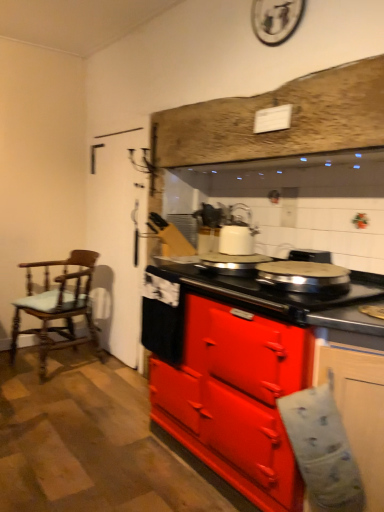
Question: Which direction should I rotate to face matte red stove at center, acting as the first cabinetry starting from the back, — up or down?

Choices:
 (A) up
 (B) down

Answer: (B)

Question: Is matte red stove at center, acting as the first cabinetry starting from the back, positioned in front of matte white cabinet at lower right, which is the first cabinetry from front to back?

Choices:
 (A) yes
 (B) no

Answer: (B)

Question: Can you confirm if matte red stove at center, acting as the first cabinetry starting from the back, is thinner than matte white cabinet at lower right, which is the first cabinetry from front to back?

Choices:
 (A) yes
 (B) no

Answer: (B)

Question: Can you confirm if matte red stove at center, positioned as the 2th cabinetry in front-to-back order, is shorter than matte white cabinet at lower right, placed as the second cabinetry when sorted from back to front?

Choices:
 (A) no
 (B) yes

Answer: (A)

Question: Is matte red stove at center, acting as the first cabinetry starting from the back, smaller than matte white cabinet at lower right, placed as the second cabinetry when sorted from back to front?

Choices:
 (A) yes
 (B) no

Answer: (B)

Question: Is matte red stove at center, acting as the first cabinetry starting from the back, further to camera compared to matte white cabinet at lower right, placed as the second cabinetry when sorted from back to front?

Choices:
 (A) no
 (B) yes

Answer: (B)

Question: Could you tell me if matte red stove at center, acting as the first cabinetry starting from the back, is facing matte white cabinet at lower right, which is the first cabinetry from front to back?

Choices:
 (A) yes
 (B) no

Answer: (B)

Question: Is white glossy kettle at center oriented towards matte white cabinet at lower right, which is the first cabinetry from front to back?

Choices:
 (A) no
 (B) yes

Answer: (A)

Question: From the image's perspective, is white glossy kettle at center located above matte white cabinet at lower right, which is the first cabinetry from front to back?

Choices:
 (A) yes
 (B) no

Answer: (A)

Question: Are white glossy kettle at center and matte white cabinet at lower right, placed as the second cabinetry when sorted from back to front, beside each other?

Choices:
 (A) yes
 (B) no

Answer: (B)

Question: Does white glossy kettle at center have a larger size compared to matte white cabinet at lower right, which is the first cabinetry from front to back?

Choices:
 (A) no
 (B) yes

Answer: (A)

Question: Are white glossy kettle at center and matte white cabinet at lower right, which is the first cabinetry from front to back, far apart?

Choices:
 (A) no
 (B) yes

Answer: (B)

Question: Considering the relative sizes of white glossy kettle at center and matte white cabinet at lower right, which is the first cabinetry from front to back, in the image provided, is white glossy kettle at center wider than matte white cabinet at lower right, which is the first cabinetry from front to back,?

Choices:
 (A) yes
 (B) no

Answer: (B)

Question: From the image's perspective, is wooden chair with cushion at left located above white glossy kettle at center?

Choices:
 (A) no
 (B) yes

Answer: (A)